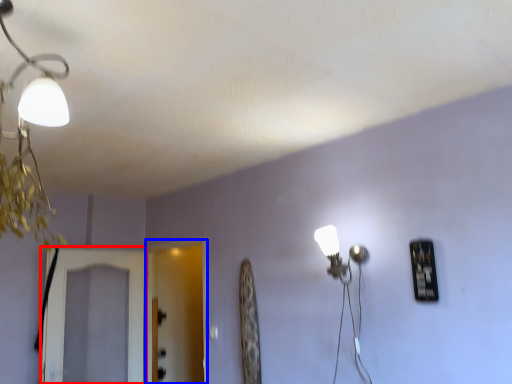
Question: Which of the following is the closest to the observer, screen door (highlighted by a red box) or screen door (highlighted by a blue box)?

Choices:
 (A) screen door
 (B) screen door

Answer: (A)